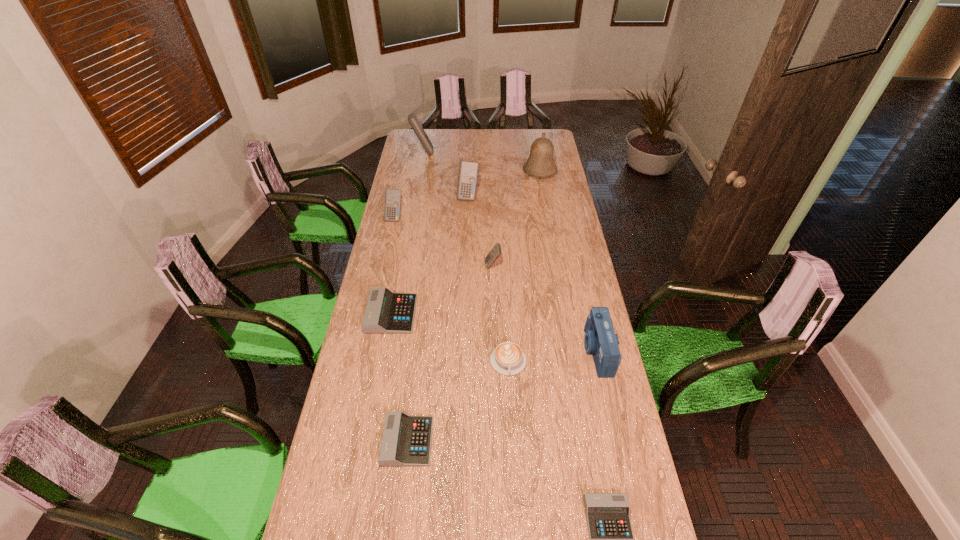
Locate an element on the screen. the farthest object is located at coordinates (412, 118).

Find the location of a particular element. Image resolution: width=960 pixels, height=540 pixels. the biggest blue calculator is located at coordinates (412, 118).

Locate an element on the screen. This screenshot has width=960, height=540. bell is located at coordinates (540, 164).

Locate an element on the screen. The height and width of the screenshot is (540, 960). the second farthest blue calculator is located at coordinates (468, 171).

Identify the location of the third calculator from right to left. (468, 171).

Where is `the second smallest blue calculator`? Image resolution: width=960 pixels, height=540 pixels. the second smallest blue calculator is located at coordinates pos(393,197).

What are the coordinates of `the fifth nearest calculator` in the screenshot? It's located at (393, 197).

The image size is (960, 540). What are the coordinates of `camera` in the screenshot? It's located at (600, 341).

I want to click on the fourth farthest calculator, so click(493, 255).

What are the coordinates of `the rightmost blue calculator` in the screenshot? It's located at (493, 255).